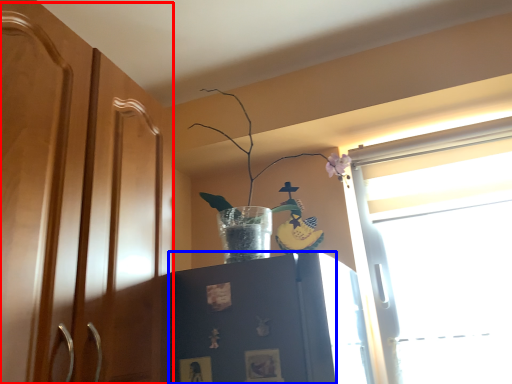
Question: Which object is closer to the camera taking this photo, dresser (highlighted by a red box) or cabinetry (highlighted by a blue box)?

Choices:
 (A) dresser
 (B) cabinetry

Answer: (A)